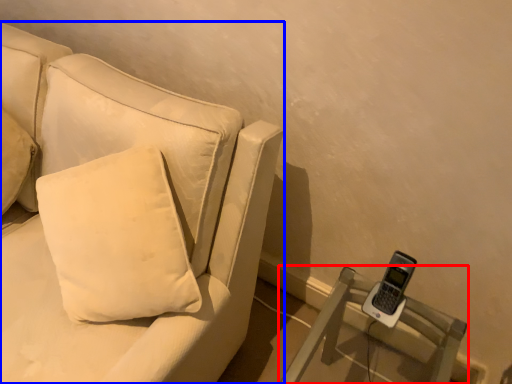
Question: Which object appears closest to the camera in this image, furniture (highlighted by a red box) or studio couch (highlighted by a blue box)?

Choices:
 (A) furniture
 (B) studio couch

Answer: (B)